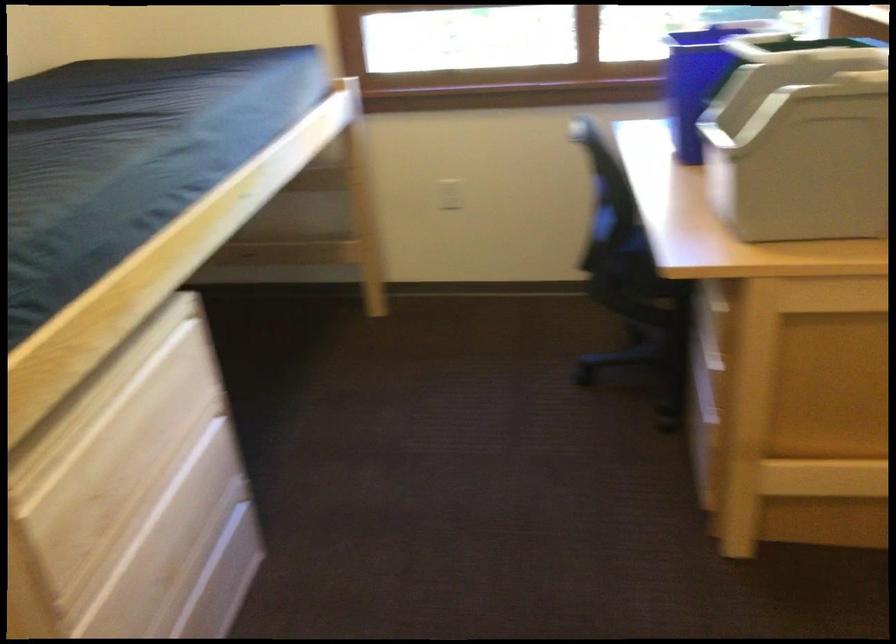
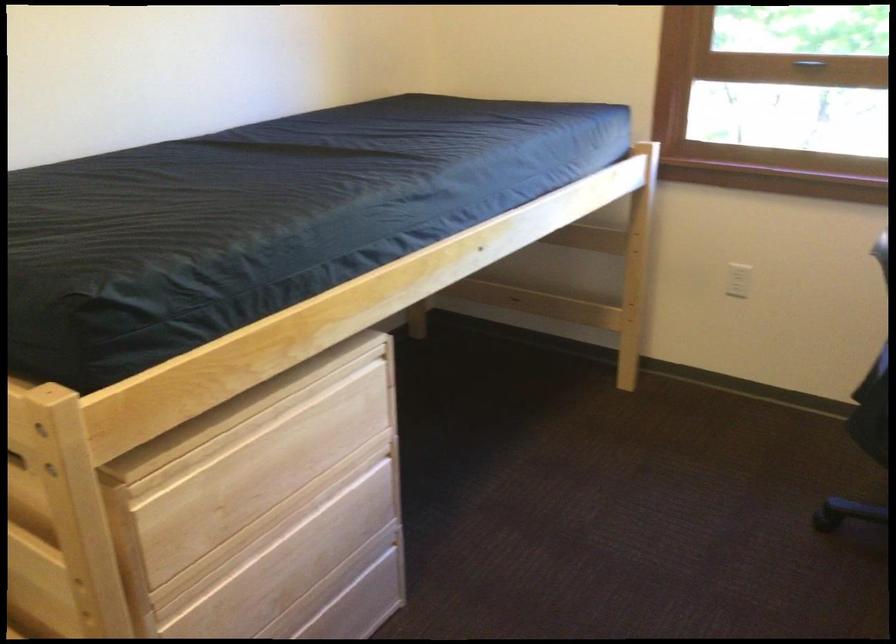
Locate, in the second image, the point that corresponds to point 226,573 in the first image.

(354, 611)